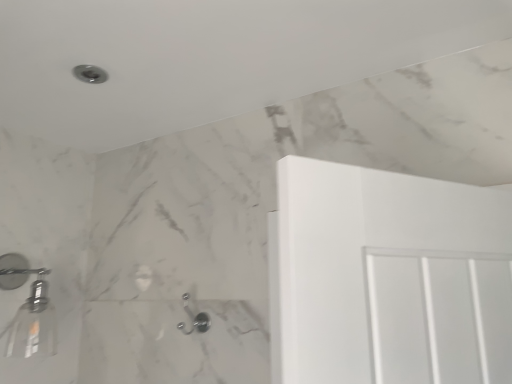
How much space does matte silver shower at upper left, placed as the 1th shower when sorted from top to bottom, occupy horizontally?

matte silver shower at upper left, placed as the 1th shower when sorted from top to bottom, is 4.27 inches in width.

I want to click on metallic silver showerhead at left, arranged as the second shower when viewed from the top, so click(x=29, y=310).

Between satin nickel hook at lower center, the 3th shower in the top-to-bottom sequence, and metallic silver showerhead at left, positioned as the 1th shower in left-to-right order, which one has larger size?

metallic silver showerhead at left, positioned as the 1th shower in left-to-right order, is bigger.

Considering the positions of objects satin nickel hook at lower center, which is the third shower from left to right, and metallic silver showerhead at left, positioned as the 1th shower in left-to-right order, in the image provided, who is more to the right, satin nickel hook at lower center, which is the third shower from left to right, or metallic silver showerhead at left, positioned as the 1th shower in left-to-right order,?

satin nickel hook at lower center, which is the third shower from left to right.

Is point (194, 327) in front of point (12, 343)?

No, (194, 327) is behind (12, 343).

Looking at this image, which of these two, metallic silver showerhead at left, positioned as the 3th shower in right-to-left order, or matte silver shower at upper left, the 2th shower when ordered from right to left, stands shorter?

matte silver shower at upper left, the 2th shower when ordered from right to left, is shorter.

Is matte silver shower at upper left, placed as the 1th shower when sorted from top to bottom, completely or partially inside metallic silver showerhead at left, positioned as the 1th shower in left-to-right order?

No, matte silver shower at upper left, placed as the 1th shower when sorted from top to bottom, is not surrounded by metallic silver showerhead at left, positioned as the 1th shower in left-to-right order.

Considering the relative sizes of metallic silver showerhead at left, positioned as the 3th shower in right-to-left order, and matte silver shower at upper left, the 2th shower when ordered from right to left, in the image provided, is metallic silver showerhead at left, positioned as the 3th shower in right-to-left order, wider than matte silver shower at upper left, the 2th shower when ordered from right to left,?

Yes, metallic silver showerhead at left, positioned as the 3th shower in right-to-left order, is wider than matte silver shower at upper left, the 2th shower when ordered from right to left.

Is metallic silver showerhead at left, positioned as the 3th shower in right-to-left order, to the right of satin nickel hook at lower center, which ranks as the first shower in right-to-left order, from the viewer's perspective?

In fact, metallic silver showerhead at left, positioned as the 3th shower in right-to-left order, is to the left of satin nickel hook at lower center, which ranks as the first shower in right-to-left order.

Find the location of a particular element. This screenshot has height=384, width=512. the 2nd shower to the left of the satin nickel hook at lower center, which ranks as the first shower in right-to-left order, starting your count from the anchor is located at coordinates (29, 310).

Could you tell me if metallic silver showerhead at left, positioned as the 3th shower in right-to-left order, is facing satin nickel hook at lower center, the 3th shower in the top-to-bottom sequence?

No, metallic silver showerhead at left, positioned as the 3th shower in right-to-left order, is not turned towards satin nickel hook at lower center, the 3th shower in the top-to-bottom sequence.

Between metallic silver showerhead at left, positioned as the 3th shower in right-to-left order, and satin nickel hook at lower center, the 3th shower in the top-to-bottom sequence, which one is positioned in front?

metallic silver showerhead at left, positioned as the 3th shower in right-to-left order.

Is matte silver shower at upper left, the 2th shower when ordered from right to left, smaller than satin nickel hook at lower center, which ranks as the first shower in bottom-to-top order?

Yes.

From the image's perspective, is matte silver shower at upper left, the 2th shower when ordered from right to left, under satin nickel hook at lower center, which is the third shower from left to right?

Incorrect, from the image's perspective, matte silver shower at upper left, the 2th shower when ordered from right to left, is higher than satin nickel hook at lower center, which is the third shower from left to right.

Is the position of matte silver shower at upper left, the 2th shower when ordered from right to left, less distant than that of satin nickel hook at lower center, the 3th shower in the top-to-bottom sequence?

Yes, matte silver shower at upper left, the 2th shower when ordered from right to left, is in front of satin nickel hook at lower center, the 3th shower in the top-to-bottom sequence.

Is matte silver shower at upper left, the 2th shower when ordered from right to left, next to satin nickel hook at lower center, the 3th shower in the top-to-bottom sequence, and touching it?

They are not placed beside each other.

Is satin nickel hook at lower center, which is the third shower from left to right, turned away from matte silver shower at upper left, placed as the 1th shower when sorted from top to bottom?

No, satin nickel hook at lower center, which is the third shower from left to right,'s orientation is not away from matte silver shower at upper left, placed as the 1th shower when sorted from top to bottom.

Considering their positions, is satin nickel hook at lower center, which ranks as the first shower in bottom-to-top order, located in front of or behind matte silver shower at upper left, the 3th shower ordered from the bottom?

In the image, satin nickel hook at lower center, which ranks as the first shower in bottom-to-top order, appears behind matte silver shower at upper left, the 3th shower ordered from the bottom.

Identify the location of the 2nd shower below the matte silver shower at upper left, the 2th shower when ordered from right to left (from the image's perspective). (194, 319).

Considering the points (85, 76) and (25, 346), which point is behind, point (85, 76) or point (25, 346)?

Point (25, 346)

How many degrees apart are the facing directions of matte silver shower at upper left, placed as the 1th shower when sorted from top to bottom, and metallic silver showerhead at left, which appears as the second shower when ordered from the bottom?

1.73 degrees separate the facing orientations of matte silver shower at upper left, placed as the 1th shower when sorted from top to bottom, and metallic silver showerhead at left, which appears as the second shower when ordered from the bottom.

From the image's perspective, is matte silver shower at upper left, which appears as the 2th shower when viewed from the left, located beneath metallic silver showerhead at left, which appears as the second shower when ordered from the bottom?

No, from the image's perspective, matte silver shower at upper left, which appears as the 2th shower when viewed from the left, is not beneath metallic silver showerhead at left, which appears as the second shower when ordered from the bottom.

Does matte silver shower at upper left, the 3th shower ordered from the bottom, turn towards metallic silver showerhead at left, arranged as the second shower when viewed from the top?

No, matte silver shower at upper left, the 3th shower ordered from the bottom, is not oriented towards metallic silver showerhead at left, arranged as the second shower when viewed from the top.

Where is `the 1st shower positioned above the satin nickel hook at lower center, which ranks as the first shower in right-to-left order (from a real-world perspective)`? The height and width of the screenshot is (384, 512). the 1st shower positioned above the satin nickel hook at lower center, which ranks as the first shower in right-to-left order (from a real-world perspective) is located at coordinates (29, 310).

Locate an element on the screen. This screenshot has width=512, height=384. the 1st shower located beneath the matte silver shower at upper left, which appears as the 2th shower when viewed from the left (from a real-world perspective) is located at coordinates (29, 310).

From the image, which object appears to be nearer to satin nickel hook at lower center, which ranks as the first shower in bottom-to-top order, metallic silver showerhead at left, which appears as the second shower when ordered from the bottom, or matte silver shower at upper left, the 3th shower ordered from the bottom?

metallic silver showerhead at left, which appears as the second shower when ordered from the bottom, is closer to satin nickel hook at lower center, which ranks as the first shower in bottom-to-top order.

Estimate the real-world distances between objects in this image. Which object is further from metallic silver showerhead at left, arranged as the second shower when viewed from the top, matte silver shower at upper left, the 2th shower when ordered from right to left, or satin nickel hook at lower center, which is the third shower from left to right?

Based on the image, matte silver shower at upper left, the 2th shower when ordered from right to left, appears to be further to metallic silver showerhead at left, arranged as the second shower when viewed from the top.

Which object lies nearer to the anchor point matte silver shower at upper left, placed as the 1th shower when sorted from top to bottom, satin nickel hook at lower center, which ranks as the first shower in right-to-left order, or metallic silver showerhead at left, arranged as the second shower when viewed from the top?

satin nickel hook at lower center, which ranks as the first shower in right-to-left order, lies closer to matte silver shower at upper left, placed as the 1th shower when sorted from top to bottom, than the other object.

Considering their positions, is satin nickel hook at lower center, which ranks as the first shower in right-to-left order, positioned closer to metallic silver showerhead at left, arranged as the second shower when viewed from the top, than matte silver shower at upper left, the 2th shower when ordered from right to left?

The object closer to metallic silver showerhead at left, arranged as the second shower when viewed from the top, is satin nickel hook at lower center, which ranks as the first shower in right-to-left order.

Looking at this image, estimate the real-world distances between objects in this image. Which object is closer to matte silver shower at upper left, the 2th shower when ordered from right to left, metallic silver showerhead at left, positioned as the 3th shower in right-to-left order, or satin nickel hook at lower center, which is the third shower from left to right?

satin nickel hook at lower center, which is the third shower from left to right, lies closer to matte silver shower at upper left, the 2th shower when ordered from right to left, than the other object.

Based on their spatial positions, is matte silver shower at upper left, which appears as the 2th shower when viewed from the left, or metallic silver showerhead at left, which appears as the second shower when ordered from the bottom, further from satin nickel hook at lower center, which is the third shower from left to right?

matte silver shower at upper left, which appears as the 2th shower when viewed from the left.

Find the location of a particular element. This screenshot has width=512, height=384. shower that lies between matte silver shower at upper left, the 2th shower when ordered from right to left, and satin nickel hook at lower center, which is the third shower from left to right, from top to bottom is located at coordinates (29, 310).